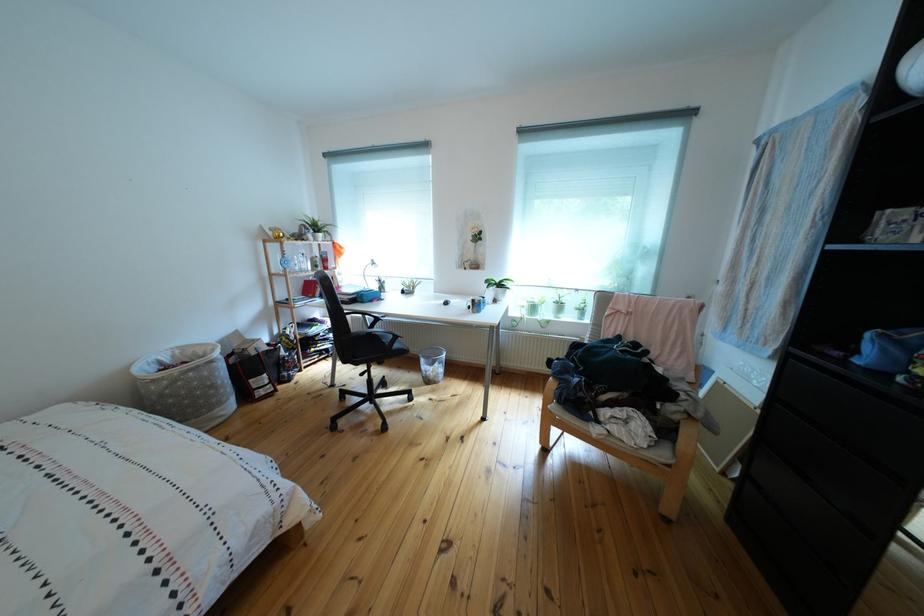
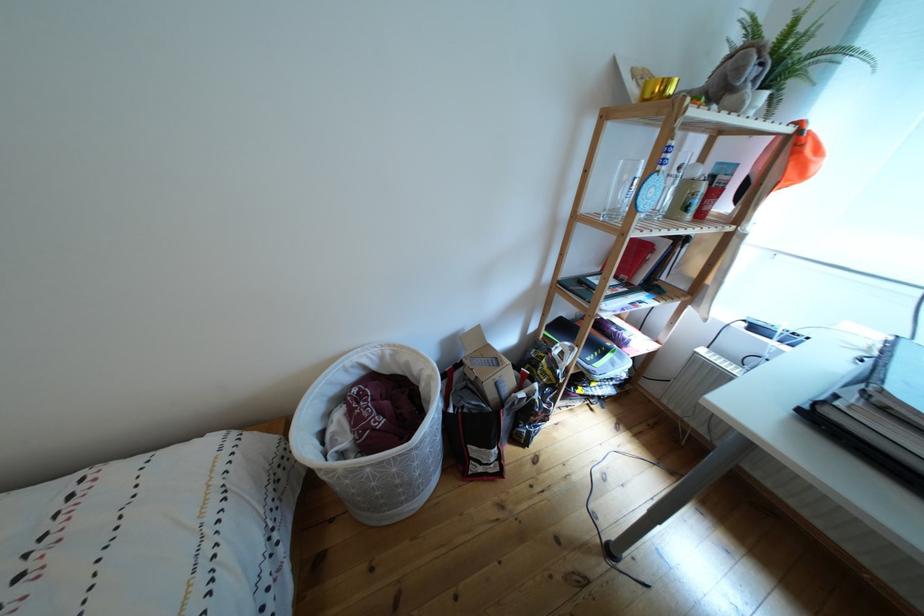
Locate, in the second image, the point that corresponds to (185,362) in the first image.

(393, 363)